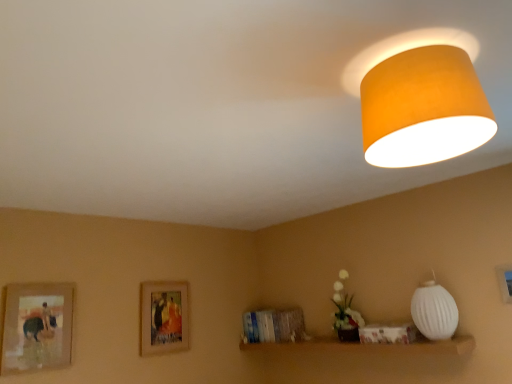
Question: Does white ribbed lampshade at right, marked as the second lamp in a top-to-bottom arrangement, have a larger size compared to wooden framed picture at center, arranged as the 2th picture frame when viewed from the right?

Choices:
 (A) no
 (B) yes

Answer: (B)

Question: From the image's perspective, does white ribbed lampshade at right, marked as the second lamp in a top-to-bottom arrangement, appear higher than wooden framed picture at center, which appears as the 2th picture frame when viewed from the left?

Choices:
 (A) no
 (B) yes

Answer: (B)

Question: Considering the relative sizes of white ribbed lampshade at right, the 1th lamp from the back, and wooden framed picture at center, arranged as the 2th picture frame when viewed from the right, in the image provided, is white ribbed lampshade at right, the 1th lamp from the back, wider than wooden framed picture at center, arranged as the 2th picture frame when viewed from the right,?

Choices:
 (A) yes
 (B) no

Answer: (A)

Question: Considering the relative sizes of white ribbed lampshade at right, which is the 2th lamp from front to back, and wooden framed picture at center, arranged as the 2th picture frame when viewed from the right, in the image provided, is white ribbed lampshade at right, which is the 2th lamp from front to back, thinner than wooden framed picture at center, arranged as the 2th picture frame when viewed from the right,?

Choices:
 (A) yes
 (B) no

Answer: (B)

Question: Can wooden framed picture at center, arranged as the 2th picture frame when viewed from the right, be found inside white ribbed lampshade at right, which is the first lamp from right to left?

Choices:
 (A) no
 (B) yes

Answer: (A)

Question: Is white ribbed lampshade at right, the 2th lamp positioned from the left, taller than wooden framed picture at center, which appears as the 2th picture frame when viewed from the left?

Choices:
 (A) yes
 (B) no

Answer: (B)

Question: From a real-world perspective, is orange fabric lampshade at upper right, marked as the first lamp in a left-to-right arrangement, located beneath wooden framed picture at center, placed as the 3th picture frame when sorted from front to back?

Choices:
 (A) no
 (B) yes

Answer: (A)

Question: From the image's perspective, is orange fabric lampshade at upper right, marked as the first lamp in a left-to-right arrangement, located beneath wooden framed picture at center, which appears as the 2th picture frame when viewed from the left?

Choices:
 (A) yes
 (B) no

Answer: (B)

Question: Is orange fabric lampshade at upper right, the 2th lamp viewed from the back, far from wooden framed picture at center, the first picture frame in the back-to-front sequence?

Choices:
 (A) no
 (B) yes

Answer: (B)

Question: Considering the relative sizes of orange fabric lampshade at upper right, marked as the first lamp in a left-to-right arrangement, and wooden framed picture at center, placed as the 3th picture frame when sorted from front to back, in the image provided, is orange fabric lampshade at upper right, marked as the first lamp in a left-to-right arrangement, smaller than wooden framed picture at center, placed as the 3th picture frame when sorted from front to back,?

Choices:
 (A) yes
 (B) no

Answer: (B)

Question: Is orange fabric lampshade at upper right, acting as the 2th lamp starting from the right, bigger than wooden framed picture at center, which appears as the 2th picture frame when viewed from the left?

Choices:
 (A) yes
 (B) no

Answer: (A)

Question: Can wooden framed picture at center, which appears as the 2th picture frame when viewed from the left, be found inside orange fabric lampshade at upper right, acting as the 2th lamp starting from the right?

Choices:
 (A) no
 (B) yes

Answer: (A)

Question: Is wooden framed picture at left, positioned as the 3th picture frame in right-to-left order, placed right next to white ribbed lampshade at right, the 1th lamp from the back?

Choices:
 (A) no
 (B) yes

Answer: (A)